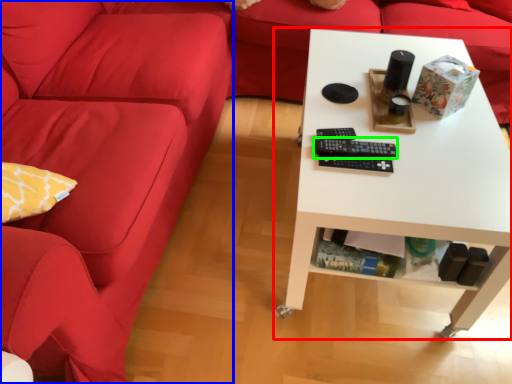
Question: Estimate the real-world distances between objects in this image. Which object is closer to table (highlighted by a red box), studio couch (highlighted by a blue box) or control (highlighted by a green box)?

Choices:
 (A) studio couch
 (B) control

Answer: (B)